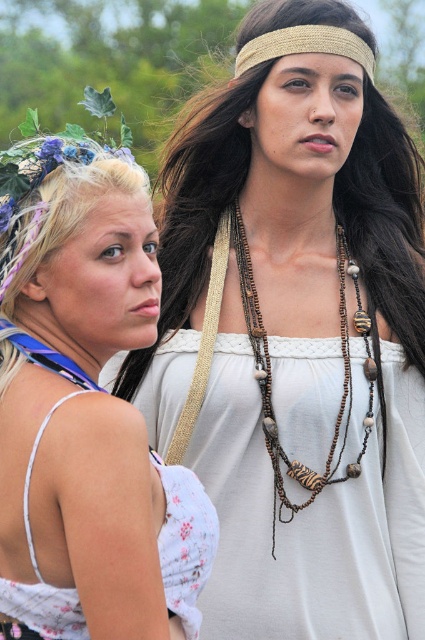
You are at a festival and want to find the gold woven headband at upper center. Which direction should you look relative to the white floral dress at left?

The gold woven headband at upper center is to the right of the white floral dress at left, so you should look to the right of the white floral dress at left to find it.

You are organizing a costume party and need to ensure all accessories fit properly. You have a white floral dress at left and a gold woven headband at upper center. Which accessory requires more space to store?

The white floral dress at left is bigger than the gold woven headband at upper center, so it requires more storage space.

You are organizing a photo shoot and need to decide which piece of clothing to feature first. Based on the image, which item is wider between the white floral dress at center and the brown beaded necklace at center?

The white floral dress at center is wider than the brown beaded necklace at center according to the description.